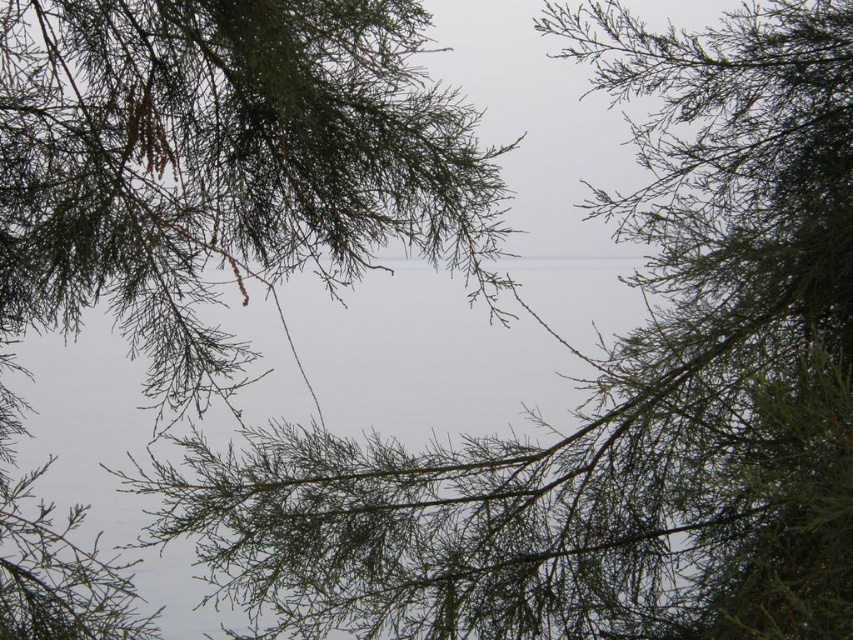
You are standing in a natural setting with a coniferous tree and a calm body of water. You notice a specific point marked at coordinates point (204, 205). What object is located at this point?

The point (204, 205) is occupied by green needle like branches at upper center.